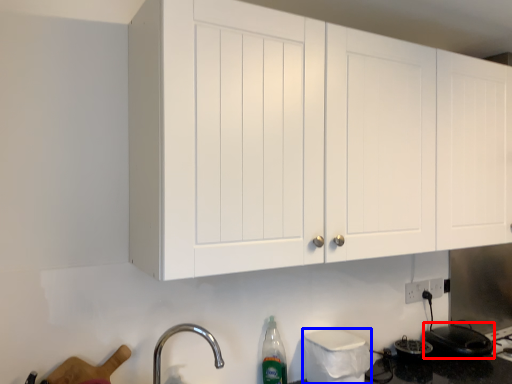
Question: Among these objects, which one is farthest to the camera, appliance (highlighted by a red box) or appliance (highlighted by a blue box)?

Choices:
 (A) appliance
 (B) appliance

Answer: (A)